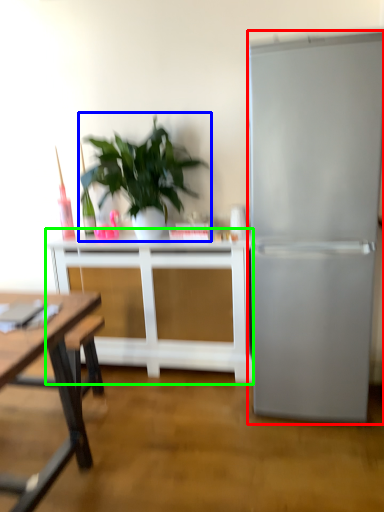
Question: Which object is positioned closest to refrigerator (highlighted by a red box)? Select from houseplant (highlighted by a blue box) and table (highlighted by a green box).

Choices:
 (A) houseplant
 (B) table

Answer: (B)